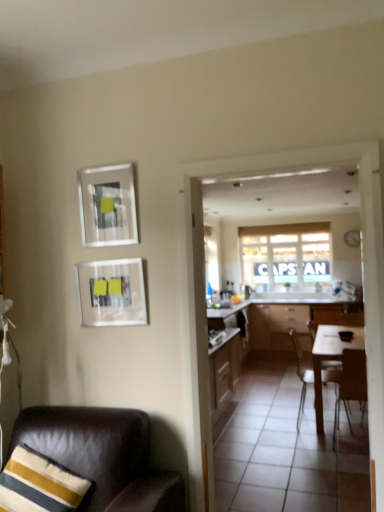
Question: Is leather chair at lower left, positioned as the third chair in back-to-front order, smaller than brown wooden chair at right, the second chair positioned from the back?

Choices:
 (A) no
 (B) yes

Answer: (A)

Question: From a real-world perspective, is leather chair at lower left, positioned as the third chair in back-to-front order, under brown wooden chair at right, acting as the first chair starting from the right?

Choices:
 (A) yes
 (B) no

Answer: (B)

Question: Does leather chair at lower left, positioned as the third chair in back-to-front order, have a larger size compared to brown wooden chair at right, the 2th chair positioned from the front?

Choices:
 (A) no
 (B) yes

Answer: (B)

Question: Considering the relative sizes of leather chair at lower left, which appears as the 1th chair when viewed from the left, and brown wooden chair at right, the 3th chair in the left-to-right sequence, in the image provided, is leather chair at lower left, which appears as the 1th chair when viewed from the left, shorter than brown wooden chair at right, the 3th chair in the left-to-right sequence,?

Choices:
 (A) yes
 (B) no

Answer: (A)

Question: From the image's perspective, does leather chair at lower left, which appears as the 1th chair when viewed from the left, appear lower than brown wooden chair at right, the second chair positioned from the back?

Choices:
 (A) no
 (B) yes

Answer: (A)

Question: Are leather chair at lower left, which appears as the 1th chair when viewed from the left, and brown wooden chair at right, the second chair positioned from the back, located far from each other?

Choices:
 (A) no
 (B) yes

Answer: (B)

Question: Is matte glass picture frame at center-left, the 2th picture frame in the top-to-bottom sequence, surrounding matte glass picture frame at upper left, acting as the first picture frame starting from the top?

Choices:
 (A) yes
 (B) no

Answer: (B)

Question: From a real-world perspective, is matte glass picture frame at center-left, acting as the first picture frame starting from the bottom, positioned under matte glass picture frame at upper left, acting as the first picture frame starting from the top, based on gravity?

Choices:
 (A) yes
 (B) no

Answer: (A)

Question: From a real-world perspective, is matte glass picture frame at center-left, acting as the first picture frame starting from the bottom, on top of matte glass picture frame at upper left, marked as the second picture frame in a bottom-to-top arrangement?

Choices:
 (A) yes
 (B) no

Answer: (B)

Question: Is the surface of matte glass picture frame at center-left, the 2th picture frame in the top-to-bottom sequence, in direct contact with matte glass picture frame at upper left, marked as the second picture frame in a bottom-to-top arrangement?

Choices:
 (A) yes
 (B) no

Answer: (B)

Question: Is matte glass picture frame at center-left, acting as the first picture frame starting from the bottom, facing towards matte glass picture frame at upper left, marked as the second picture frame in a bottom-to-top arrangement?

Choices:
 (A) no
 (B) yes

Answer: (A)

Question: Are matte glass picture frame at center-left, acting as the first picture frame starting from the bottom, and matte glass picture frame at upper left, marked as the second picture frame in a bottom-to-top arrangement, far apart?

Choices:
 (A) yes
 (B) no

Answer: (B)

Question: Is matte glass picture frame at upper left, acting as the first picture frame starting from the top, bigger than white fabric window at center?

Choices:
 (A) yes
 (B) no

Answer: (B)